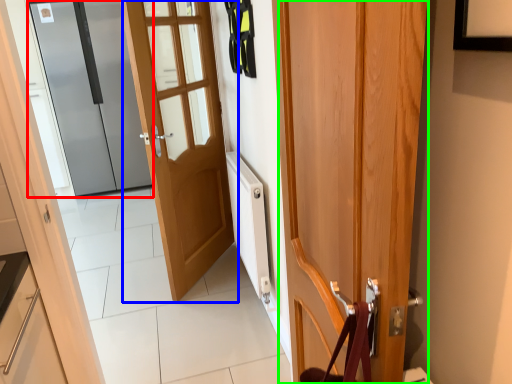
Question: Which is nearer to the door (highlighted by a red box)? door (highlighted by a blue box) or door (highlighted by a green box).

Choices:
 (A) door
 (B) door

Answer: (A)